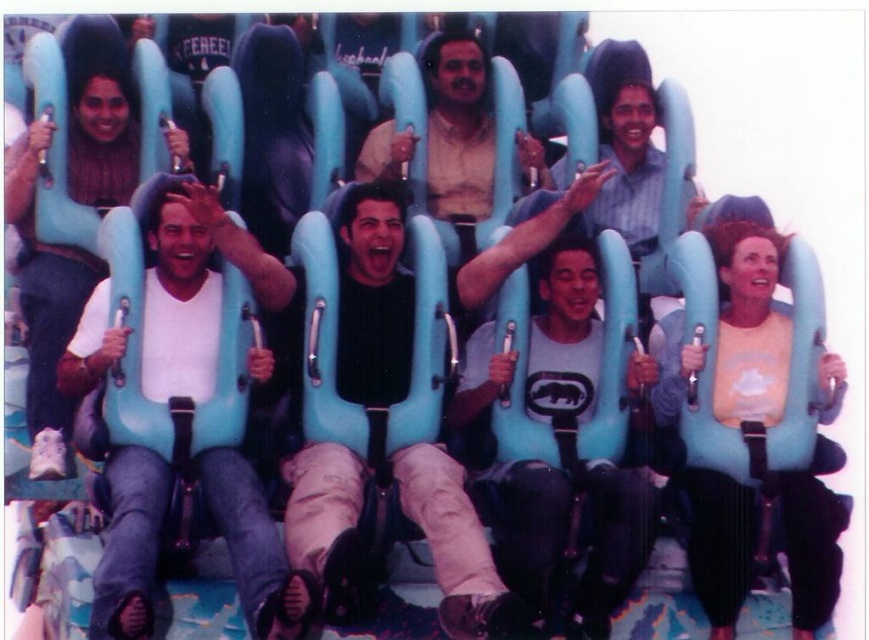
Question: Among these points, which one is nearest to the camera?

Choices:
 (A) (209, 481)
 (B) (456, 193)
 (C) (80, 147)
 (D) (594, 502)

Answer: (A)

Question: Where is matte black shirt at center located in relation to matte beige shirt at center in the image?

Choices:
 (A) left
 (B) right

Answer: (A)

Question: Does white matte t-shirt at center appear under matte black shirt at center?

Choices:
 (A) yes
 (B) no

Answer: (A)

Question: Considering the relative positions of white matte t-shirt at center and white matte t-shirt at left in the image provided, where is white matte t-shirt at center located with respect to white matte t-shirt at left?

Choices:
 (A) left
 (B) right

Answer: (B)

Question: Which point is closer to the camera taking this photo?

Choices:
 (A) (586, 401)
 (B) (78, 321)
 (C) (478, 74)
 (D) (60, 332)

Answer: (B)

Question: Which of the following is the closest to the observer?

Choices:
 (A) (453, 97)
 (B) (91, 346)
 (C) (45, 412)

Answer: (B)